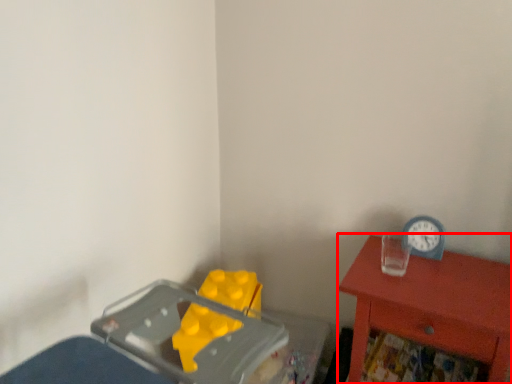
Question: From the image's perspective, where is nightstand (annotated by the red box) located in relation to clock in the image?

Choices:
 (A) below
 (B) above

Answer: (A)